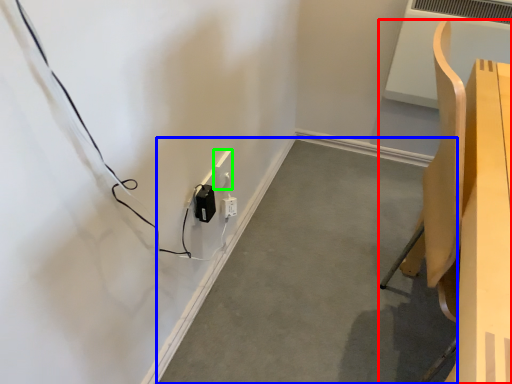
Question: Which object is positioned closest to furniture (highlighted by a red box)? Select from concrete (highlighted by a blue box) and electric outlet (highlighted by a green box).

Choices:
 (A) concrete
 (B) electric outlet

Answer: (A)